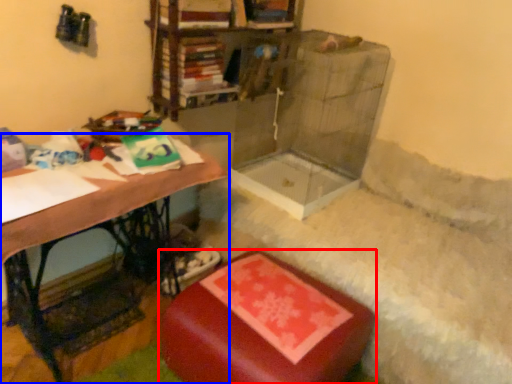
Question: Which object is further to the camera taking this photo, furniture (highlighted by a red box) or table (highlighted by a blue box)?

Choices:
 (A) furniture
 (B) table

Answer: (A)